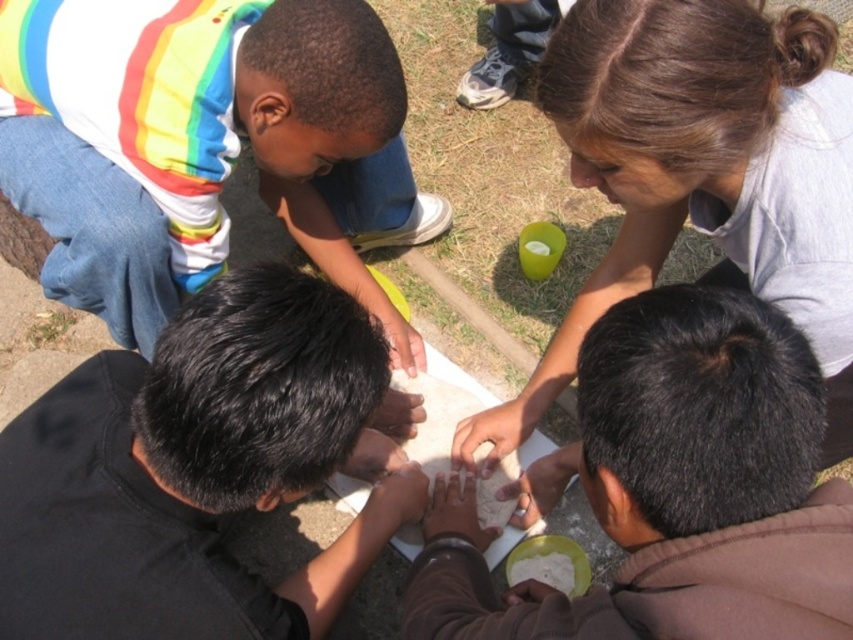
Question: Is black matte shirt at center wider than dark brown hair at upper center?

Choices:
 (A) yes
 (B) no

Answer: (B)

Question: Does black matte shirt at center have a smaller size compared to dark brown hair at upper center?

Choices:
 (A) no
 (B) yes

Answer: (B)

Question: Which object appears farthest from the camera in this image?

Choices:
 (A) black matte shirt at center
 (B) dark brown hair at upper center

Answer: (B)

Question: Estimate the real-world distances between objects in this image. Which object is closer to the dark brown hair at upper center?

Choices:
 (A) black matte shirt at center
 (B) rainbow striped shirt at upper left

Answer: (A)

Question: Among these points, which one is farthest from the camera?

Choices:
 (A) (213, 262)
 (B) (228, 618)
 (C) (836, 387)

Answer: (A)

Question: Can you confirm if dark brown hair at upper center is positioned to the left of rainbow striped shirt at upper left?

Choices:
 (A) yes
 (B) no

Answer: (B)